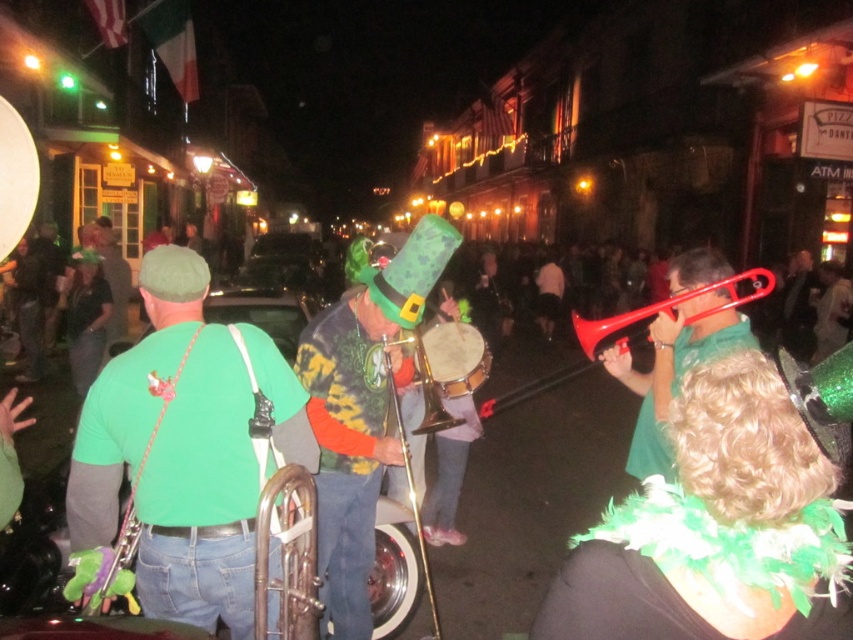
Question: Can you confirm if shiny red trumpet at center is positioned above brass shiny trumpet at center?

Choices:
 (A) yes
 (B) no

Answer: (A)

Question: Does tie-dye fabric at center lie behind green matte hat at upper center?

Choices:
 (A) no
 (B) yes

Answer: (A)

Question: Which of the following is the closest to the observer?

Choices:
 (A) (113, 305)
 (B) (107, 516)
 (C) (712, 308)

Answer: (B)

Question: Which object is the farthest from the green matte t-shirt at center?

Choices:
 (A) shiny red trumpet at center
 (B) green matte hat at upper center
 (C) green feather boa at center

Answer: (B)

Question: Which of the following is the farthest from the observer?

Choices:
 (A) red plastic trumpet at center right
 (B) green matte t-shirt at center
 (C) green matte hat at upper center
 (D) tie-dye fabric at center

Answer: (C)

Question: Does tie-dye fabric at center appear under green matte hat at upper center?

Choices:
 (A) yes
 (B) no

Answer: (A)